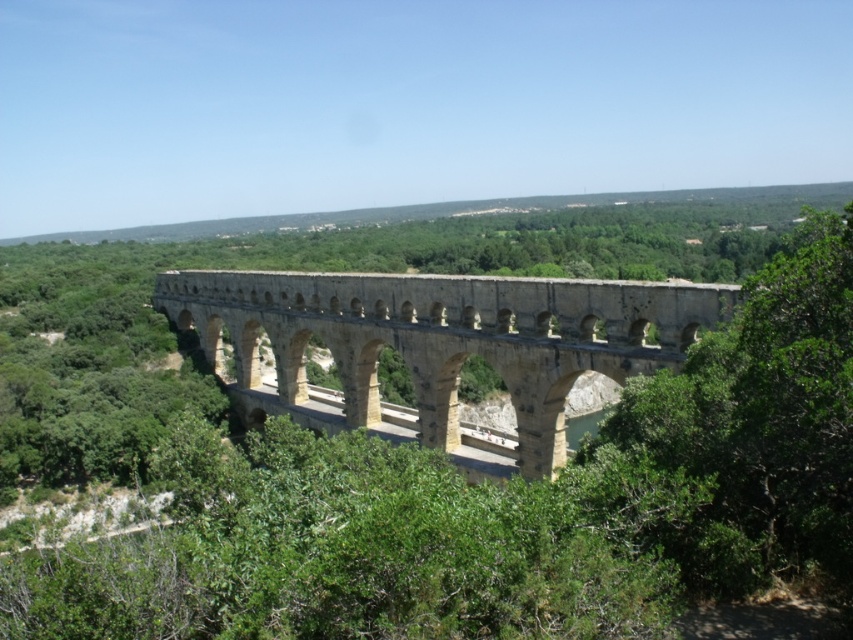
You are standing near the ancient aqueduct and want to take a photo of the green leafy tree at center. If your camera has a maximum zoom range of 10 meters, can you capture the tree without moving closer?

The green leafy tree at center is 33.45 meters from the viewer, which exceeds the camera maximum zoom range of 10 meters. Therefore, you cannot capture the tree without moving closer.

You are a tourist standing near the green leafy tree at center and want to take a photo of the stone arch bridge at center. Since the tree is blocking part of the bridge, can you move to the right or left to get a clear view? Explain why based on their positions.

The green leafy tree at center is positioned under the stone arch bridge at center. To get a clear view of the stone arch bridge at center without obstruction, you should move either to the right or left so that the tree is no longer directly in front of the bridge.